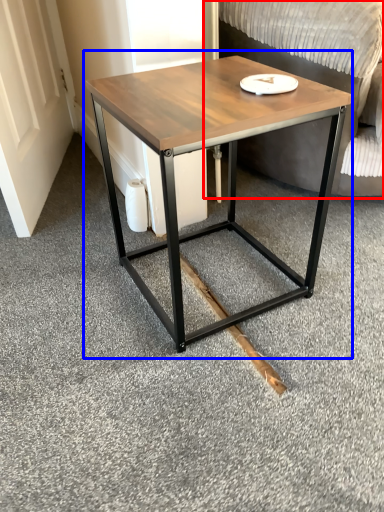
Question: Which of the following is the closest to the observer, swivel chair (highlighted by a red box) or coffee table (highlighted by a blue box)?

Choices:
 (A) swivel chair
 (B) coffee table

Answer: (B)